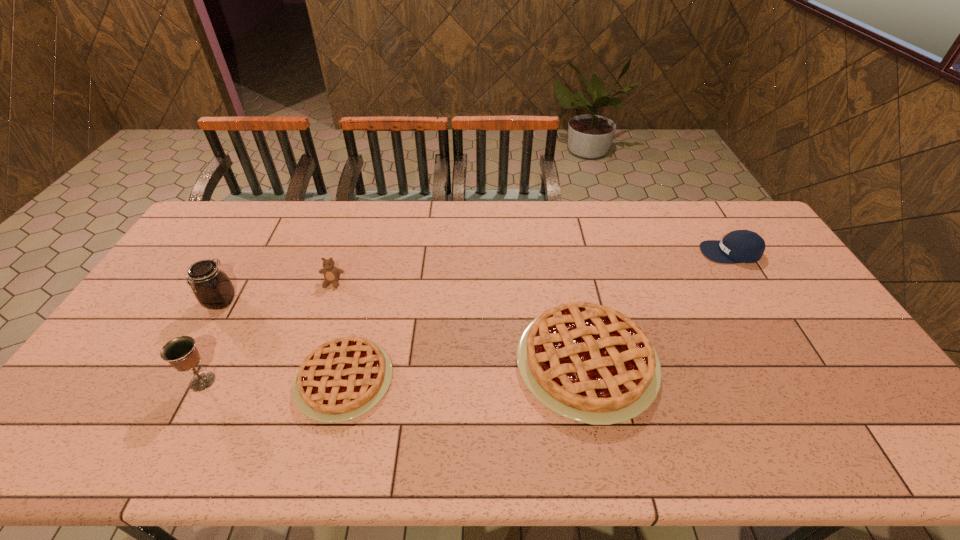
Identify the location of vacant region located 0.090m on the left of the taller pie. The height and width of the screenshot is (540, 960). (482, 363).

The image size is (960, 540). I want to click on vacant space located 0.100m on the lid of the jar, so click(199, 341).

Locate an element on the screen. The image size is (960, 540). free region located 0.090m on the front-facing side of the teddy bear is located at coordinates (323, 311).

Identify the location of vacant space situated 0.400m on the front-facing side of the farthest object. (583, 252).

This screenshot has height=540, width=960. Find the location of `blank space located on the front-facing side of the farthest object`. blank space located on the front-facing side of the farthest object is located at coordinates (621, 252).

Image resolution: width=960 pixels, height=540 pixels. Find the location of `free region located on the front-facing side of the farthest object`. free region located on the front-facing side of the farthest object is located at coordinates (594, 252).

Where is `vacant space located 0.070m on the back of the chalice`? vacant space located 0.070m on the back of the chalice is located at coordinates (220, 348).

At what (x,y) coordinates should I click in order to perform the action: click on chalice at the near edge. Please return your answer as a coordinate pair (x, y). Looking at the image, I should click on (181, 353).

Find the location of a particular element. The width and height of the screenshot is (960, 540). object that is at the right edge is located at coordinates (740, 246).

Where is `vacant area at the far edge`? vacant area at the far edge is located at coordinates (584, 202).